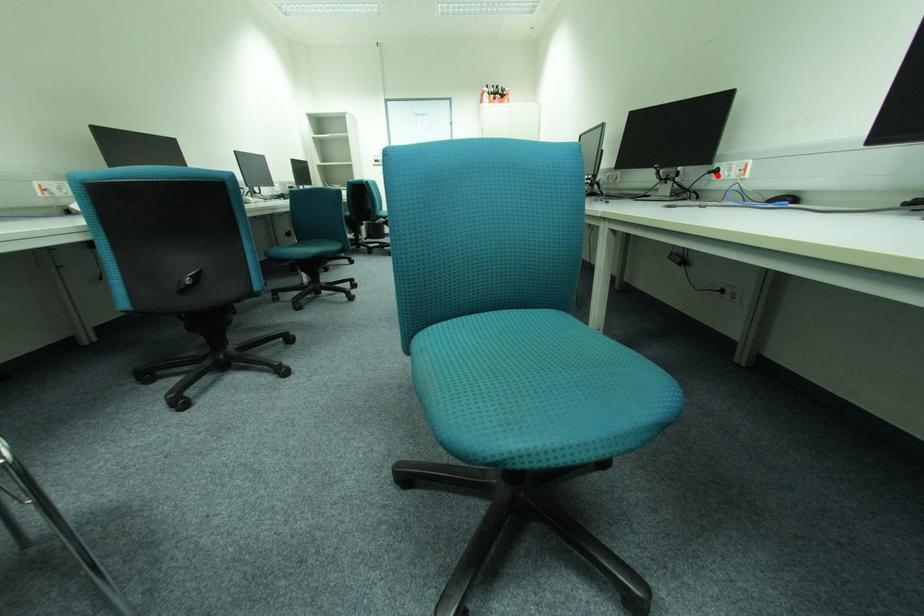
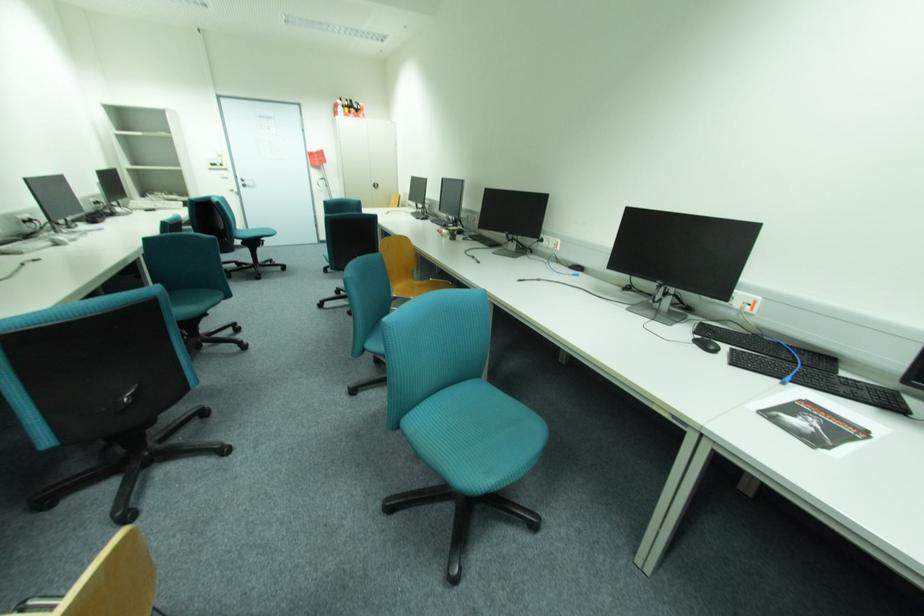
Question: A red point is marked in image1. In image2, is the corresponding 3D point closer to the camera or farther? Reply with the corresponding letter.

Choices:
 (A) The corresponding 3D point is closer.
 (B) The corresponding 3D point is farther.

Answer: (A)